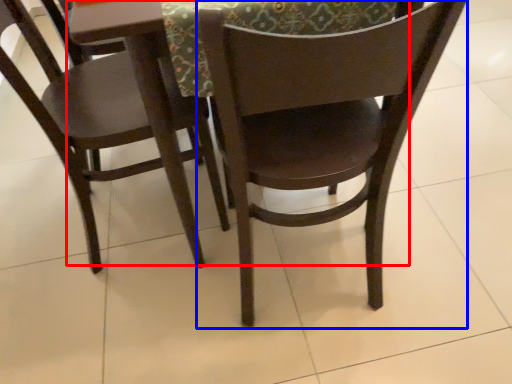
Question: Which object appears closest to the camera in this image, round table (highlighted by a red box) or chair (highlighted by a blue box)?

Choices:
 (A) round table
 (B) chair

Answer: (B)